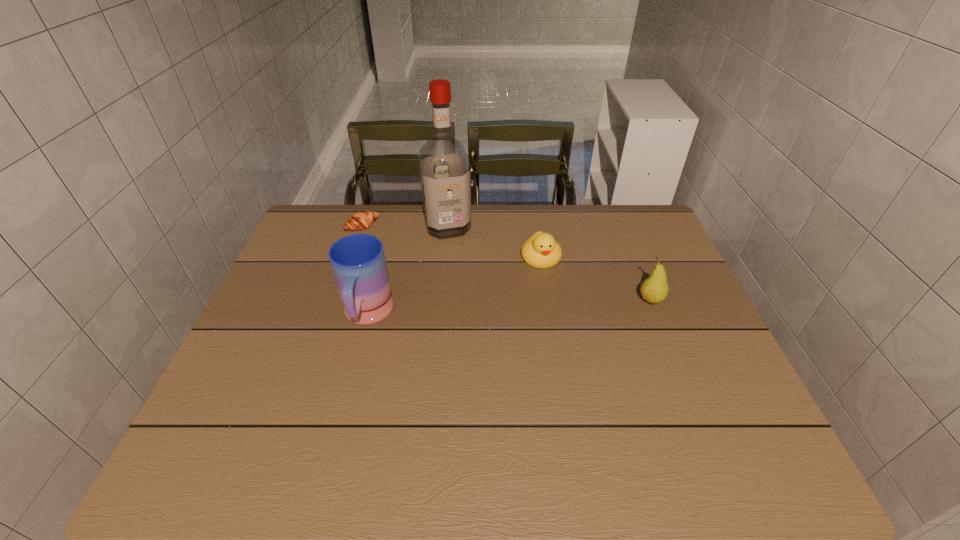
At what (x,y) coordinates should I click in order to perform the action: click on vacant space at the far right corner of the desktop. Please return your answer as a coordinate pair (x, y). Looking at the image, I should click on (620, 218).

Where is `vacant area at the near right corner of the desktop`? This screenshot has height=540, width=960. vacant area at the near right corner of the desktop is located at coordinates (750, 406).

Find the location of a particular element. The image size is (960, 540). unoccupied position between the pastry and the pear is located at coordinates (507, 264).

Locate an element on the screen. vacant space that is in between the duckling and the liquor is located at coordinates (494, 242).

Image resolution: width=960 pixels, height=540 pixels. Find the location of `empty location between the fourth shortest object and the fourth object from left to right`. empty location between the fourth shortest object and the fourth object from left to right is located at coordinates (454, 287).

Locate an element on the screen. The width and height of the screenshot is (960, 540). vacant region between the pastry and the fourth tallest object is located at coordinates (452, 242).

This screenshot has width=960, height=540. I want to click on free point between the liquor and the fourth shortest object, so click(407, 272).

I want to click on vacant space that's between the shortest object and the duckling, so click(452, 242).

At what (x,y) coordinates should I click in order to perform the action: click on vacant space that is in between the shortest object and the third tallest object. Please return your answer as a coordinate pair (x, y). Looking at the image, I should click on (507, 264).

This screenshot has width=960, height=540. I want to click on object that is the third closest one to the shortest object, so [541, 250].